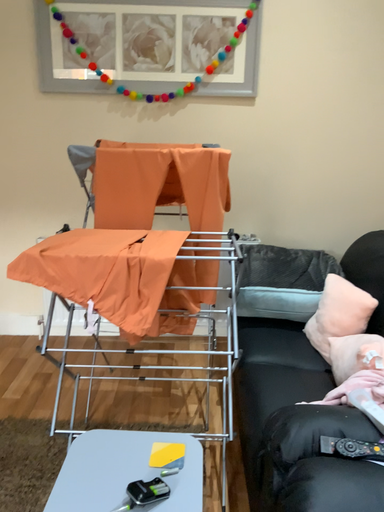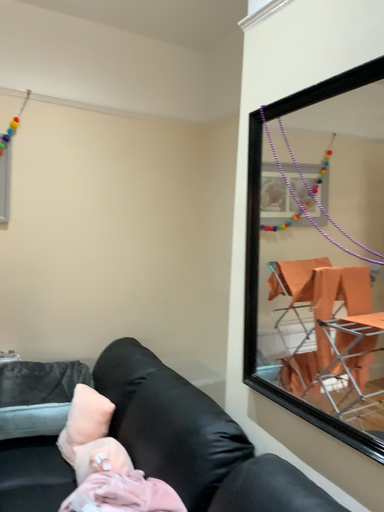
Question: Which way did the camera rotate in the video?

Choices:
 (A) rotated upward
 (B) rotated downward

Answer: (A)